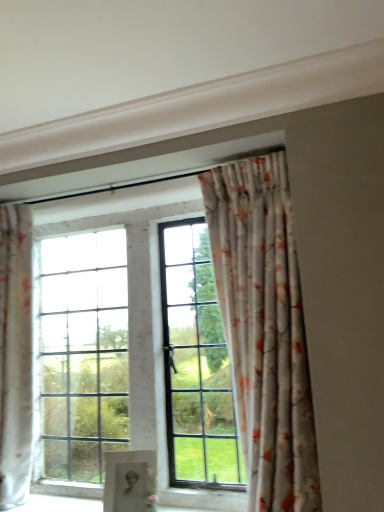
Question: Could you tell me if floral fabric curtain at left, arranged as the 1th curtain when viewed from the left, is facing floral fabric curtain at upper center, the first curtain viewed from the right?

Choices:
 (A) yes
 (B) no

Answer: (B)

Question: Is floral fabric curtain at left, arranged as the second curtain when viewed from the right, directly adjacent to floral fabric curtain at upper center, arranged as the 2th curtain when viewed from the left?

Choices:
 (A) yes
 (B) no

Answer: (B)

Question: Is there a large distance between floral fabric curtain at left, arranged as the second curtain when viewed from the right, and floral fabric curtain at upper center, the first curtain viewed from the right?

Choices:
 (A) yes
 (B) no

Answer: (A)

Question: Is floral fabric curtain at left, arranged as the 1th curtain when viewed from the left, looking in the opposite direction of floral fabric curtain at upper center, arranged as the 2th curtain when viewed from the left?

Choices:
 (A) no
 (B) yes

Answer: (A)

Question: Can you confirm if floral fabric curtain at left, arranged as the 1th curtain when viewed from the left, is smaller than floral fabric curtain at upper center, the first curtain viewed from the right?

Choices:
 (A) no
 (B) yes

Answer: (B)

Question: From the image's perspective, relative to floral fabric curtain at left, arranged as the 1th curtain when viewed from the left, is floral fabric curtain at upper center, arranged as the 2th curtain when viewed from the left, above or below?

Choices:
 (A) below
 (B) above

Answer: (B)

Question: Is floral fabric curtain at upper center, arranged as the 2th curtain when viewed from the left, bigger or smaller than floral fabric curtain at left, arranged as the 1th curtain when viewed from the left?

Choices:
 (A) big
 (B) small

Answer: (A)

Question: Does point (210, 176) appear closer or farther from the camera than point (1, 323)?

Choices:
 (A) farther
 (B) closer

Answer: (B)

Question: From a real-world perspective, is floral fabric curtain at upper center, the first curtain viewed from the right, physically located above or below floral fabric curtain at left, arranged as the 1th curtain when viewed from the left?

Choices:
 (A) below
 (B) above

Answer: (B)

Question: From the image's perspective, is floral fabric curtain at left, arranged as the 1th curtain when viewed from the left, positioned above or below matte black portrait at center?

Choices:
 (A) above
 (B) below

Answer: (A)

Question: Is floral fabric curtain at left, arranged as the second curtain when viewed from the right, taller or shorter than matte black portrait at center?

Choices:
 (A) tall
 (B) short

Answer: (A)

Question: In terms of size, does floral fabric curtain at left, arranged as the 1th curtain when viewed from the left, appear bigger or smaller than matte black portrait at center?

Choices:
 (A) big
 (B) small

Answer: (A)

Question: Do you think floral fabric curtain at left, arranged as the second curtain when viewed from the right, is within matte black portrait at center, or outside of it?

Choices:
 (A) inside
 (B) outside

Answer: (B)

Question: Considering the positions of floral fabric curtain at upper center, arranged as the 2th curtain when viewed from the left, and matte black portrait at center in the image, is floral fabric curtain at upper center, arranged as the 2th curtain when viewed from the left, taller or shorter than matte black portrait at center?

Choices:
 (A) tall
 (B) short

Answer: (A)

Question: Considering the positions of floral fabric curtain at upper center, the first curtain viewed from the right, and matte black portrait at center in the image, is floral fabric curtain at upper center, the first curtain viewed from the right, bigger or smaller than matte black portrait at center?

Choices:
 (A) big
 (B) small

Answer: (A)